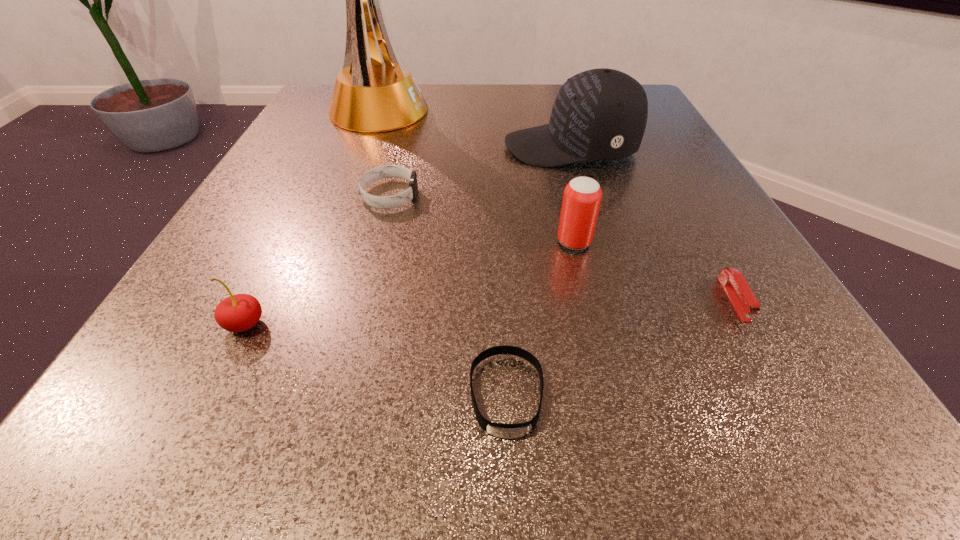
I want to click on free space between the fifth nearest object and the stapler, so click(x=562, y=247).

Locate an element on the screen. vacant space that is in between the nearer wristband and the tallest object is located at coordinates (441, 253).

Select which object is the sixth closest to the nearest object. Please provide its 2D coordinates. Your answer should be formatted as a tuple, i.e. [(x, y)], where the tuple contains the x and y coordinates of a point satisfying the conditions above.

[(381, 95)]

Identify which object is the closest to the trophy. Please provide its 2D coordinates. Your answer should be formatted as a tuple, i.e. [(x, y)], where the tuple contains the x and y coordinates of a point satisfying the conditions above.

[(600, 114)]

Find the location of `free space that satisfies the following two spatial constraints: 1. at the front of the baseball cap where the brim is located; 2. on the display of the right wristband`. free space that satisfies the following two spatial constraints: 1. at the front of the baseball cap where the brim is located; 2. on the display of the right wristband is located at coordinates (646, 395).

The width and height of the screenshot is (960, 540). Find the location of `free location that satisfies the following two spatial constraints: 1. on the back side of the fourth farthest object; 2. on the left side of the cherry`. free location that satisfies the following two spatial constraints: 1. on the back side of the fourth farthest object; 2. on the left side of the cherry is located at coordinates (286, 242).